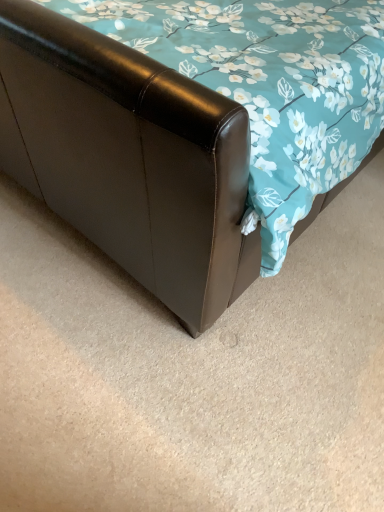
Find the location of a particular element. The width and height of the screenshot is (384, 512). brown leather bed at center is located at coordinates (129, 158).

Describe the element at coordinates (129, 158) in the screenshot. I see `brown leather bed at center` at that location.

Locate an element on the screen. brown leather bed at center is located at coordinates (129, 158).